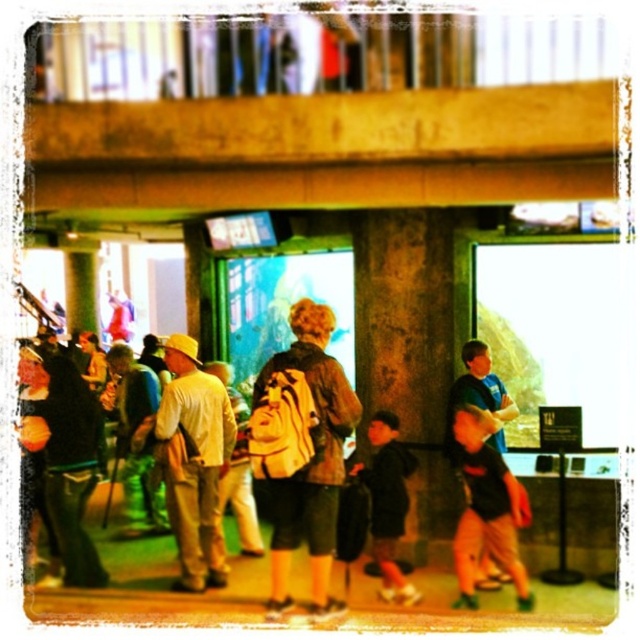
Between point (326, 364) and point (36, 371), which one is positioned in front?

Point (326, 364) is more forward.

Does point (312, 436) come farther from viewer compared to point (70, 524)?

That is False.

Is point (330, 378) behind point (96, 563)?

No, (330, 378) is closer to viewer.

The image size is (640, 640). Identify the location of matte brown backpack at center. (301, 451).

In the scene shown: Is dark green pants at left to the left of black cotton shirt at center from the viewer's perspective?

Correct, you'll find dark green pants at left to the left of black cotton shirt at center.

Between point (54, 509) and point (484, 417), which one is positioned behind?

The point (54, 509) is behind.

This screenshot has width=640, height=640. Identify the location of dark green pants at left. (68, 467).

Is point (493, 547) less distant than point (141, 436)?

That is True.

Locate an element on the screen. This screenshot has height=640, width=640. black cotton shirt at center is located at coordinates (486, 509).